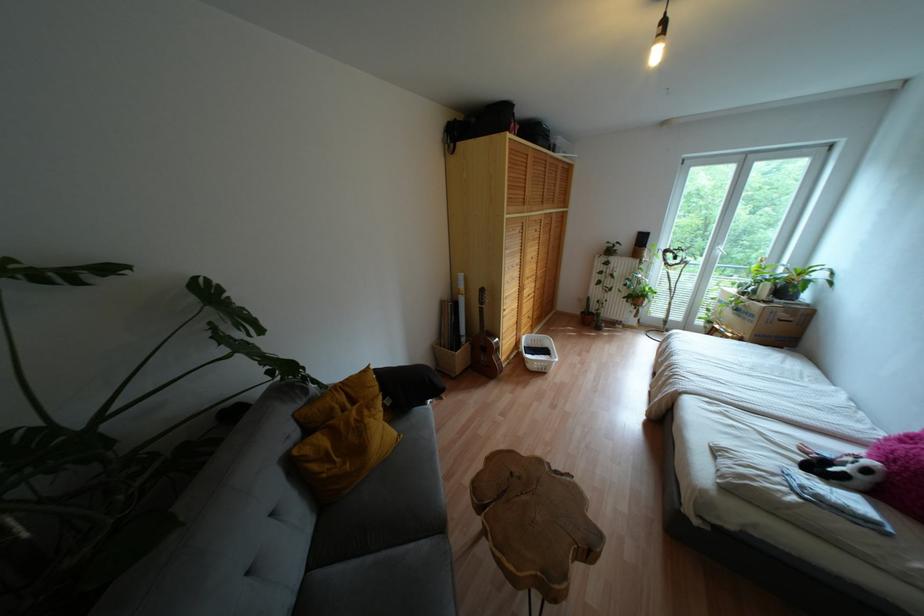
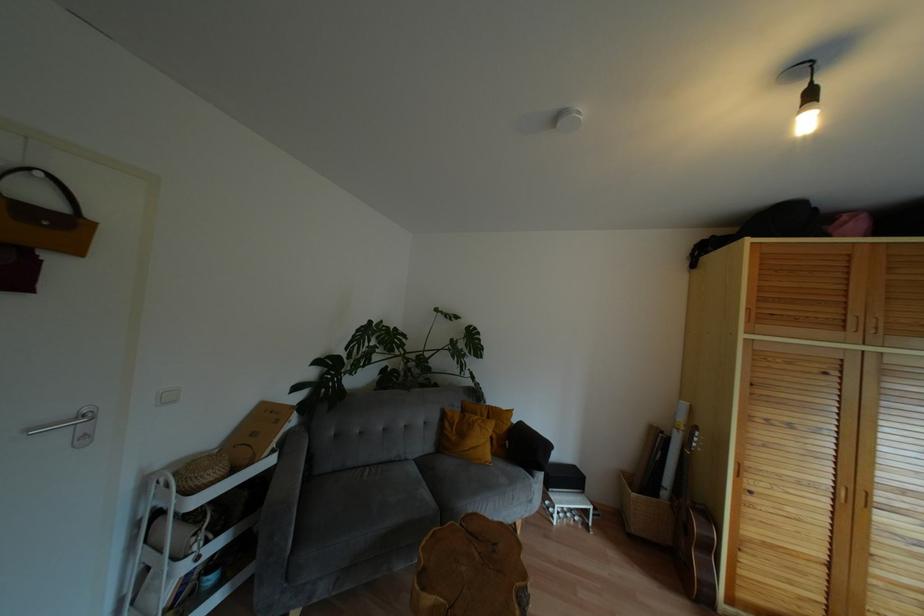
Locate, in the second image, the point that corresponds to point (657, 53) in the first image.

(806, 123)